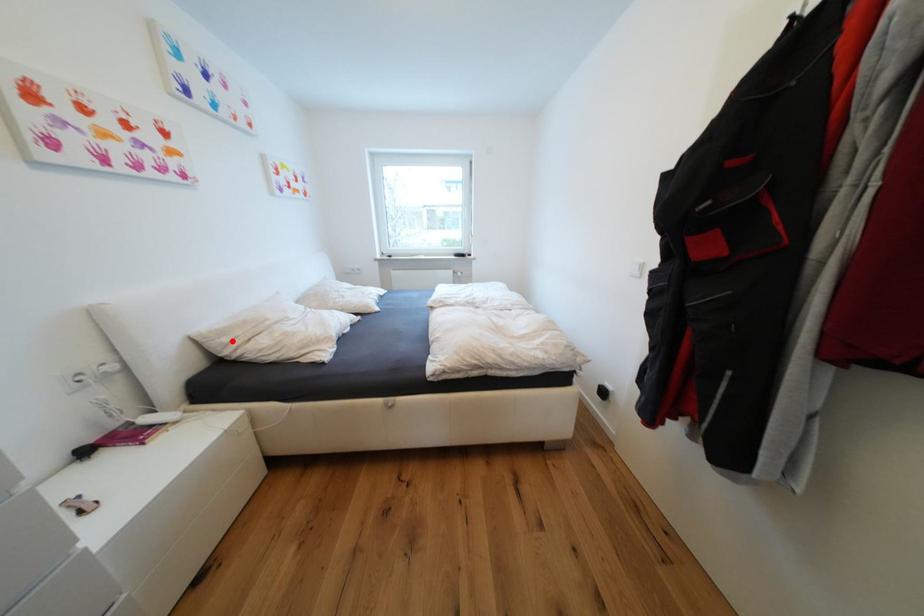
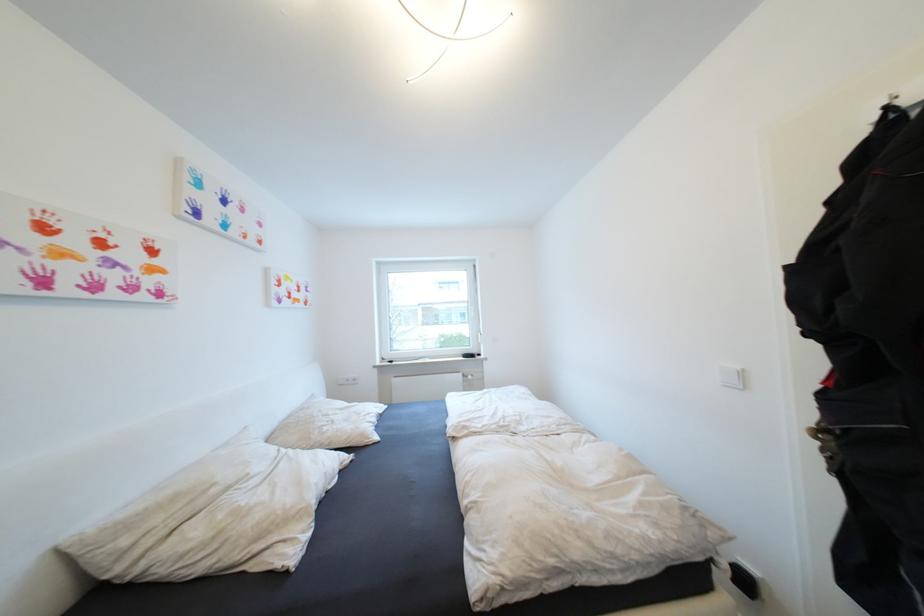
Question: A red point is marked in image1. In image2, is the corresponding 3D point closer to the camera or farther? Reply with the corresponding letter.

Choices:
 (A) The corresponding 3D point is closer.
 (B) The corresponding 3D point is farther.

Answer: (A)